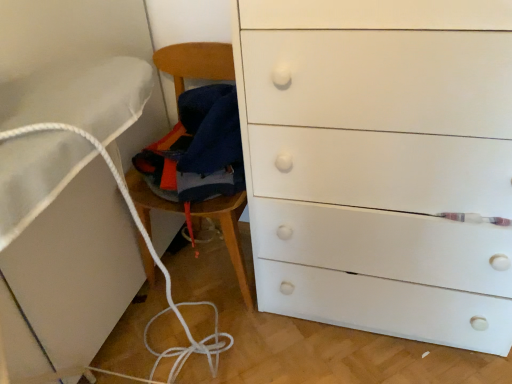
Describe the element at coordinates (381, 164) in the screenshot. Image resolution: width=512 pixels, height=384 pixels. I see `white matte chest of drawers at center` at that location.

You are a GUI agent. You are given a task and a screenshot of the screen. Output one action in this format:
    pyautogui.click(x=<x>, y=<y>)
    Task: Click on the white matte chest of drawers at center
    This screenshot has width=512, height=384.
    Given the screenshot: What is the action you would take?
    pyautogui.click(x=381, y=164)

I want to click on white matte chest of drawers at center, so click(x=381, y=164).